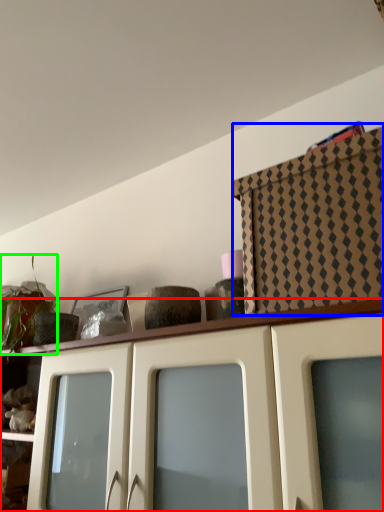
Question: Which is farther away from cabinetry (highlighted by a red box)? cabinetry (highlighted by a blue box) or plant (highlighted by a green box)?

Choices:
 (A) cabinetry
 (B) plant

Answer: (B)